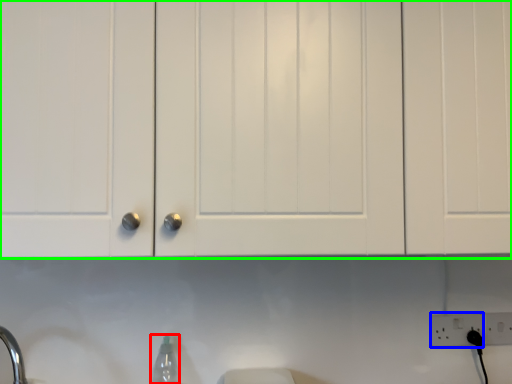
Question: Considering the real-world distances, which object is closest to bottle (highlighted by a red box)? electric outlet (highlighted by a blue box) or cabinetry (highlighted by a green box).

Choices:
 (A) electric outlet
 (B) cabinetry

Answer: (B)